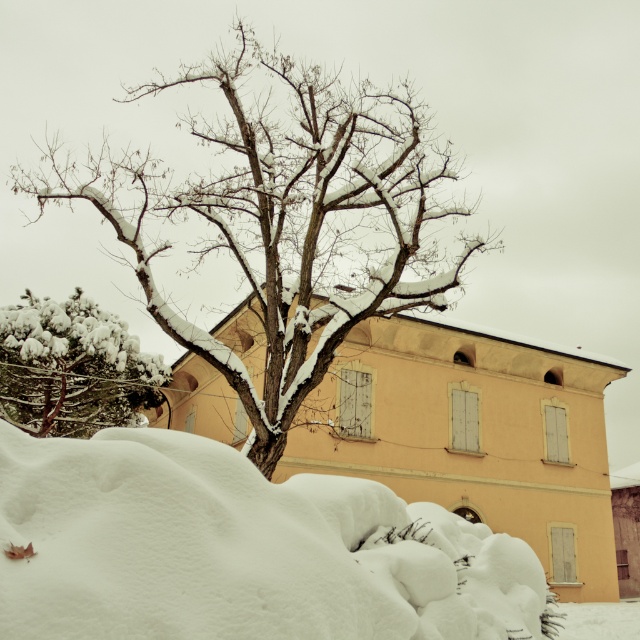
Question: Which object is positioned farthest from the green snow-covered bush at lower left?

Choices:
 (A) white fluffy snow at lower center
 (B) snow-covered branches at center

Answer: (A)

Question: Estimate the real-world distances between objects in this image. Which object is farther from the snow-covered branches at center?

Choices:
 (A) white fluffy snow at lower center
 (B) green snow-covered bush at lower left

Answer: (A)

Question: Which object is positioned closest to the green snow-covered bush at lower left?

Choices:
 (A) snow-covered branches at center
 (B) white fluffy snow at lower center

Answer: (A)

Question: Observing the image, what is the correct spatial positioning of white fluffy snow at lower center in reference to snow-covered branches at center?

Choices:
 (A) right
 (B) left

Answer: (A)

Question: Does snow-covered branches at center have a smaller size compared to green snow-covered bush at lower left?

Choices:
 (A) yes
 (B) no

Answer: (B)

Question: Can you confirm if white fluffy snow at lower center is bigger than green snow-covered bush at lower left?

Choices:
 (A) yes
 (B) no

Answer: (B)